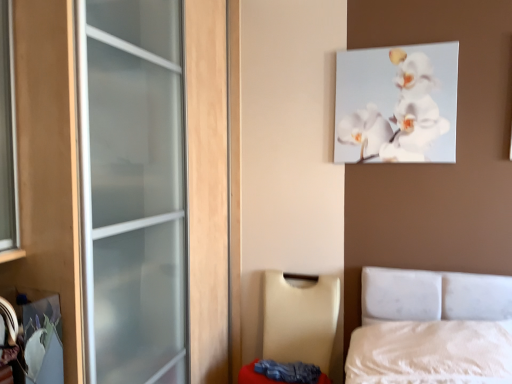
Question: Should I look upward or downward to see beige leather chair at lower center?

Choices:
 (A) down
 (B) up

Answer: (A)

Question: Can you confirm if white glossy orchid at upper center is bigger than beige leather chair at lower center?

Choices:
 (A) yes
 (B) no

Answer: (B)

Question: From a real-world perspective, is white glossy orchid at upper center physically above beige leather chair at lower center?

Choices:
 (A) yes
 (B) no

Answer: (A)

Question: Is white glossy orchid at upper center facing towards beige leather chair at lower center?

Choices:
 (A) yes
 (B) no

Answer: (B)

Question: Considering the relative positions of white glossy orchid at upper center and beige leather chair at lower center in the image provided, is white glossy orchid at upper center behind beige leather chair at lower center?

Choices:
 (A) no
 (B) yes

Answer: (B)

Question: Is white glossy orchid at upper center thinner than beige leather chair at lower center?

Choices:
 (A) no
 (B) yes

Answer: (B)

Question: From a real-world perspective, is white glossy orchid at upper center under beige leather chair at lower center?

Choices:
 (A) no
 (B) yes

Answer: (A)

Question: Is white glossy orchid at upper center touching white fabric mattress at lower right?

Choices:
 (A) yes
 (B) no

Answer: (B)

Question: Is white glossy orchid at upper center taller than white fabric mattress at lower right?

Choices:
 (A) yes
 (B) no

Answer: (A)

Question: Does white glossy orchid at upper center turn towards white fabric mattress at lower right?

Choices:
 (A) no
 (B) yes

Answer: (A)

Question: Is white glossy orchid at upper center completely or partially outside of white fabric mattress at lower right?

Choices:
 (A) yes
 (B) no

Answer: (A)

Question: Does white glossy orchid at upper center have a smaller size compared to white fabric mattress at lower right?

Choices:
 (A) no
 (B) yes

Answer: (B)

Question: From a real-world perspective, is white glossy orchid at upper center over white fabric mattress at lower right?

Choices:
 (A) yes
 (B) no

Answer: (A)

Question: Is beige leather chair at lower center aimed at white glossy orchid at upper center?

Choices:
 (A) yes
 (B) no

Answer: (B)